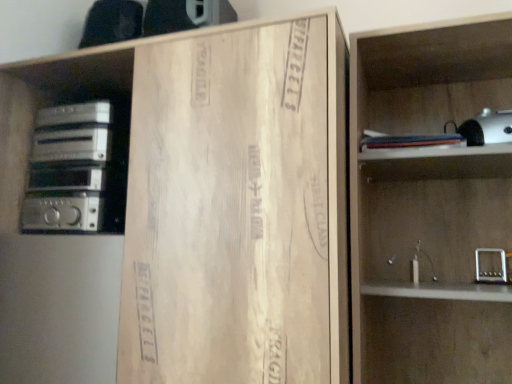
Question: Is wooden cardboard at center oriented away from silver metallic stereo at left?

Choices:
 (A) no
 (B) yes

Answer: (B)

Question: From the image's perspective, is wooden cardboard at center below silver metallic stereo at left?

Choices:
 (A) yes
 (B) no

Answer: (A)

Question: Is wooden cardboard at center thinner than silver metallic stereo at left?

Choices:
 (A) yes
 (B) no

Answer: (B)

Question: Is wooden cardboard at center far from silver metallic stereo at left?

Choices:
 (A) no
 (B) yes

Answer: (A)

Question: Does wooden cardboard at center contain silver metallic stereo at left?

Choices:
 (A) no
 (B) yes

Answer: (B)

Question: Does wooden cardboard at center have a larger size compared to silver metallic stereo at left?

Choices:
 (A) no
 (B) yes

Answer: (B)

Question: Is wooden shelf at right at the back of wooden cardboard at center?

Choices:
 (A) yes
 (B) no

Answer: (B)

Question: Does wooden cardboard at center have a greater width compared to wooden shelf at right?

Choices:
 (A) no
 (B) yes

Answer: (B)

Question: Is wooden shelf at right located within wooden cardboard at center?

Choices:
 (A) no
 (B) yes

Answer: (A)

Question: Is wooden cardboard at center to the right of wooden shelf at right from the viewer's perspective?

Choices:
 (A) no
 (B) yes

Answer: (A)

Question: Does wooden cardboard at center have a greater height compared to wooden shelf at right?

Choices:
 (A) yes
 (B) no

Answer: (A)

Question: Does wooden cardboard at center have a smaller size compared to wooden shelf at right?

Choices:
 (A) yes
 (B) no

Answer: (B)

Question: Is silver metallic stereo at left closer to the viewer compared to wooden shelf at right?

Choices:
 (A) no
 (B) yes

Answer: (A)